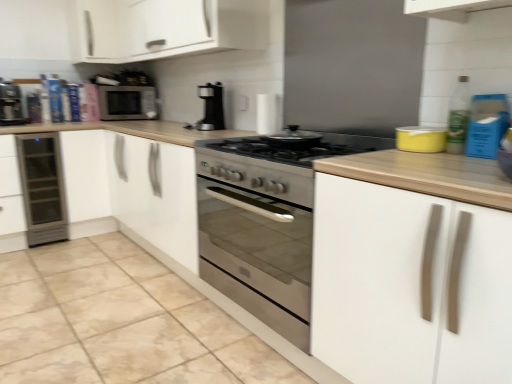
Question: Is yellow matte container at upper right, which appears as the second appliance when viewed from the back, in front of or behind matte black coffee machine at left in the image?

Choices:
 (A) behind
 (B) front

Answer: (B)

Question: From a real-world perspective, is yellow matte container at upper right, which is counted as the first appliance, starting from the right, physically located above or below matte black coffee machine at left?

Choices:
 (A) above
 (B) below

Answer: (B)

Question: Considering the real-world distances, which object is farthest from the white glossy pot at center, which is counted as the first appliance, starting from the left?

Choices:
 (A) sleek stainless steel wine cooler at left
 (B) yellow matte container at upper right, which is counted as the first appliance, starting from the right
 (C) matte black microwave at upper left
 (D) white matte cabinet at upper left, the second cabinetry from the front
 (E) black plastic coffee maker at center

Answer: (A)

Question: Based on their relative distances, which object is nearer to the black plastic coffee maker at center?

Choices:
 (A) sleek stainless steel wine cooler at left
 (B) yellow matte container at upper right, which appears as the second appliance when viewed from the left
 (C) matte black microwave at upper left
 (D) matte black coffee machine at left
 (E) white glossy pot at center, the 2th appliance positioned from the right

Answer: (E)